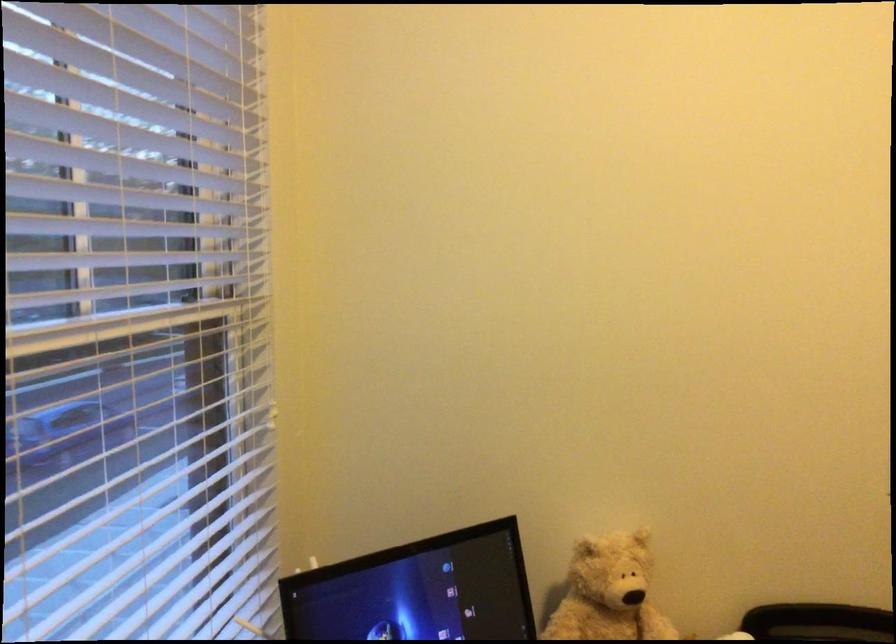
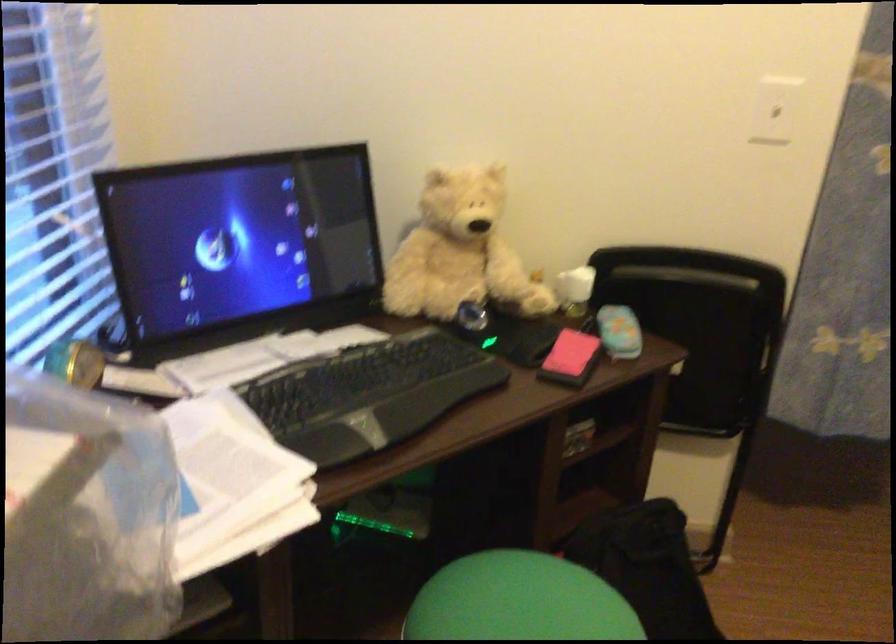
Question: The first image is from the beginning of the video and the second image is from the end. How did the camera likely rotate when shooting the video?

Choices:
 (A) Left
 (B) Right
 (C) Up
 (D) Down

Answer: (D)